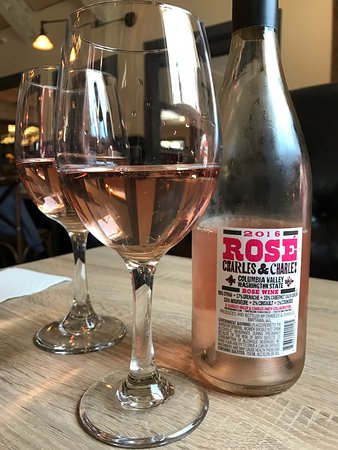
Where is `napkin`? This screenshot has height=450, width=338. napkin is located at coordinates (x=21, y=285).